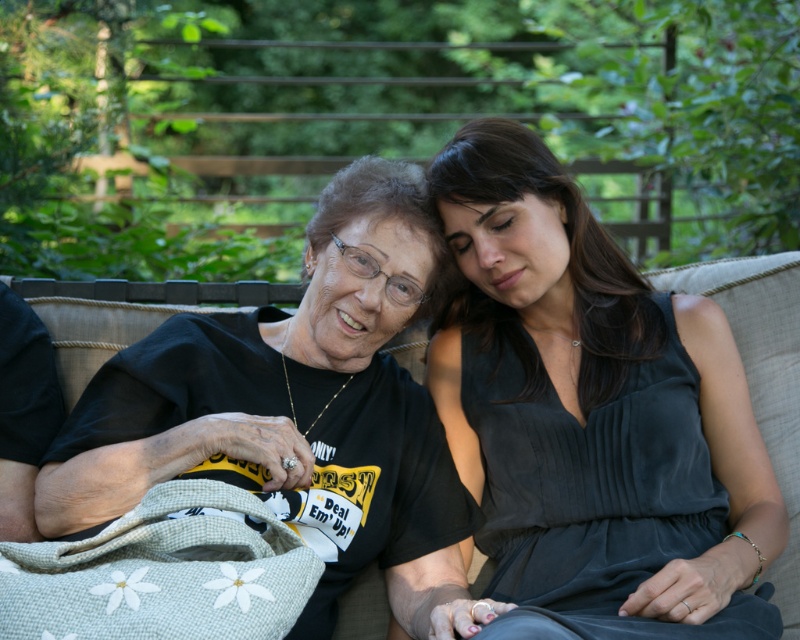
Is matte black t-shirt at center wider than black matte t-shirt at center?

No, matte black t-shirt at center is not wider than black matte t-shirt at center.

Who is more distant from viewer, (752, 452) or (276, 508)?

Positioned behind is point (752, 452).

This screenshot has height=640, width=800. I want to click on matte black t-shirt at center, so click(x=592, y=412).